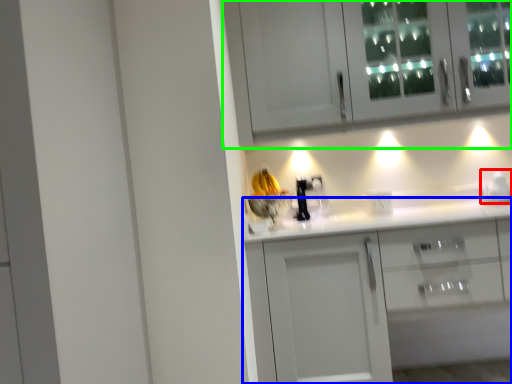
Question: Estimate the real-world distances between objects in this image. Which object is farther from appliance (highlighted by a red box), cabinetry (highlighted by a blue box) or cabinetry (highlighted by a green box)?

Choices:
 (A) cabinetry
 (B) cabinetry

Answer: (B)